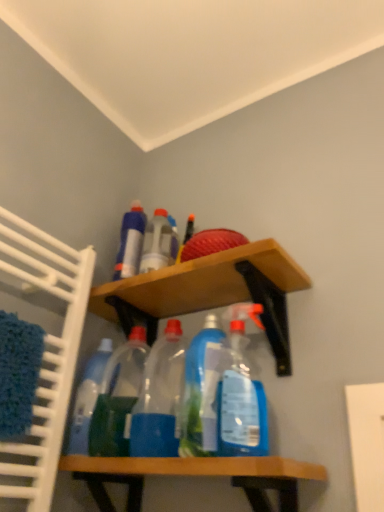
Locate an element on the screen. Image resolution: width=384 pixels, height=512 pixels. wooden shelf at lower center, the second shelf when ordered from top to bottom is located at coordinates (196, 475).

This screenshot has height=512, width=384. Identify the location of wooden shelf at upper center, which ranks as the second shelf in bottom-to-top order. (209, 292).

What do you see at coordinates (158, 243) in the screenshot?
I see `translucent plastic bottle at upper center, marked as the fourth bottle in a right-to-left arrangement` at bounding box center [158, 243].

This screenshot has width=384, height=512. What do you see at coordinates (130, 242) in the screenshot?
I see `blue plastic bottle at upper center, marked as the 6th bottle in a right-to-left arrangement` at bounding box center [130, 242].

The height and width of the screenshot is (512, 384). What do you see at coordinates (118, 397) in the screenshot?
I see `transparent plastic bottle at center, the 2th bottle when ordered from left to right` at bounding box center [118, 397].

Measure the distance between transparent plastic bottle at center, which is the fifth bottle from right to left, and camera.

transparent plastic bottle at center, which is the fifth bottle from right to left, and camera are 34.02 inches apart from each other.

At what (x,y) coordinates should I click in order to perform the action: click on transparent plastic bottles at center, the fourth bottle positioned from the left. Please return your answer as a coordinate pair (x, y). The width and height of the screenshot is (384, 512). Looking at the image, I should click on (160, 397).

Which object is wider, blue translucent bottle at center, placed as the second bottle when sorted from right to left, or transparent plastic bottles at center, the fourth bottle positioned from the left?

transparent plastic bottles at center, the fourth bottle positioned from the left.

Is blue translucent bottle at center, placed as the second bottle when sorted from right to left, facing towards transparent plastic bottles at center, the fourth bottle positioned from the left?

No, blue translucent bottle at center, placed as the second bottle when sorted from right to left, is not turned towards transparent plastic bottles at center, the fourth bottle positioned from the left.

From the image's perspective, is blue translucent bottle at center, placed as the second bottle when sorted from right to left, located above transparent plastic bottles at center, the fourth bottle positioned from the left?

Yes.

I want to click on the 1st bottle counting from the left of the blue translucent bottle at center, placed as the second bottle when sorted from right to left, so click(160, 397).

Is transparent plastic bottle at center, the 2th bottle when ordered from left to right, facing away from blue plastic bottle at upper center, the first bottle viewed from the left?

No, transparent plastic bottle at center, the 2th bottle when ordered from left to right,'s orientation is not away from blue plastic bottle at upper center, the first bottle viewed from the left.

From the image's perspective, is transparent plastic bottle at center, which is the fifth bottle from right to left, located above or below blue plastic bottle at upper center, the first bottle viewed from the left?

Clearly, from the image's perspective, transparent plastic bottle at center, which is the fifth bottle from right to left, is below blue plastic bottle at upper center, the first bottle viewed from the left.

The height and width of the screenshot is (512, 384). Identify the location of the 5th bottle directly beneath the blue plastic bottle at upper center, marked as the 6th bottle in a right-to-left arrangement (from a real-world perspective). (118, 397).

Is transparent plastic bottle at center, the 2th bottle when ordered from left to right, at the left side of blue plastic bottle at upper center, marked as the 6th bottle in a right-to-left arrangement?

Incorrect, transparent plastic bottle at center, the 2th bottle when ordered from left to right, is not on the left side of blue plastic bottle at upper center, marked as the 6th bottle in a right-to-left arrangement.

Is translucent plastic bottle at upper center, marked as the fourth bottle in a right-to-left arrangement, facing towards wooden shelf at upper center, which ranks as the second shelf in bottom-to-top order?

No.

Which of these two, translucent plastic bottle at upper center, which is counted as the 3th bottle, starting from the left, or wooden shelf at upper center, which ranks as the second shelf in bottom-to-top order, stands taller?

translucent plastic bottle at upper center, which is counted as the 3th bottle, starting from the left.

From the picture: From the image's perspective, is translucent plastic bottle at upper center, which is counted as the 3th bottle, starting from the left, on top of wooden shelf at upper center, which is counted as the first shelf, starting from the top?

Indeed, from the image's perspective, translucent plastic bottle at upper center, which is counted as the 3th bottle, starting from the left, is shown above wooden shelf at upper center, which is counted as the first shelf, starting from the top.

Is translucent plastic bottle at upper center, marked as the fourth bottle in a right-to-left arrangement, located outside wooden shelf at upper center, which is counted as the first shelf, starting from the top?

Absolutely, translucent plastic bottle at upper center, marked as the fourth bottle in a right-to-left arrangement, is external to wooden shelf at upper center, which is counted as the first shelf, starting from the top.

From the image's perspective, is blue plastic bottle at upper center, marked as the 6th bottle in a right-to-left arrangement, above or below blue translucent spray bottle at center, marked as the 1th bottle in a right-to-left arrangement?

Clearly, from the image's perspective, blue plastic bottle at upper center, marked as the 6th bottle in a right-to-left arrangement, is above blue translucent spray bottle at center, marked as the 1th bottle in a right-to-left arrangement.

Is blue plastic bottle at upper center, marked as the 6th bottle in a right-to-left arrangement, surrounding blue translucent spray bottle at center, marked as the 1th bottle in a right-to-left arrangement?

No, blue plastic bottle at upper center, marked as the 6th bottle in a right-to-left arrangement, does not contain blue translucent spray bottle at center, marked as the 1th bottle in a right-to-left arrangement.

Which object is wider, blue plastic bottle at upper center, marked as the 6th bottle in a right-to-left arrangement, or blue translucent spray bottle at center, placed as the 6th bottle when sorted from left to right?

With larger width is blue plastic bottle at upper center, marked as the 6th bottle in a right-to-left arrangement.

Measure the distance between translucent plastic bottle at upper center, which is counted as the 3th bottle, starting from the left, and blue plastic bottle at upper center, the first bottle viewed from the left.

translucent plastic bottle at upper center, which is counted as the 3th bottle, starting from the left, and blue plastic bottle at upper center, the first bottle viewed from the left, are 2.43 inches apart from each other.

Which is in front, point (149, 239) or point (126, 220)?

Positioned in front is point (149, 239).

Is translucent plastic bottle at upper center, which is counted as the 3th bottle, starting from the left, bigger or smaller than blue plastic bottle at upper center, the first bottle viewed from the left?

In the image, translucent plastic bottle at upper center, which is counted as the 3th bottle, starting from the left, appears to be smaller than blue plastic bottle at upper center, the first bottle viewed from the left.

Which object is further away from the camera taking this photo, translucent plastic bottle at upper center, which is counted as the 3th bottle, starting from the left, or blue plastic bottle at upper center, the first bottle viewed from the left?

Positioned behind is blue plastic bottle at upper center, the first bottle viewed from the left.

Can you confirm if transparent plastic bottle at center, the 2th bottle when ordered from left to right, is bigger than transparent plastic bottles at center, the fourth bottle positioned from the left?

No.

Considering the relative positions of transparent plastic bottle at center, the 2th bottle when ordered from left to right, and transparent plastic bottles at center, the 3th bottle in the right-to-left sequence, in the image provided, is transparent plastic bottle at center, the 2th bottle when ordered from left to right, in front of transparent plastic bottles at center, the 3th bottle in the right-to-left sequence,?

No.

Is transparent plastic bottle at center, the 2th bottle when ordered from left to right, facing away from transparent plastic bottles at center, the fourth bottle positioned from the left?

No, transparent plastic bottle at center, the 2th bottle when ordered from left to right, is not facing the opposite direction of transparent plastic bottles at center, the fourth bottle positioned from the left.

Is translucent plastic bottle at upper center, marked as the fourth bottle in a right-to-left arrangement, in front of or behind transparent plastic bottles at center, the 3th bottle in the right-to-left sequence, in the image?

Clearly, translucent plastic bottle at upper center, marked as the fourth bottle in a right-to-left arrangement, is behind transparent plastic bottles at center, the 3th bottle in the right-to-left sequence.

Who is bigger, translucent plastic bottle at upper center, which is counted as the 3th bottle, starting from the left, or transparent plastic bottles at center, the fourth bottle positioned from the left?

Bigger between the two is transparent plastic bottles at center, the fourth bottle positioned from the left.

From the picture: Is translucent plastic bottle at upper center, marked as the fourth bottle in a right-to-left arrangement, in contact with transparent plastic bottles at center, the fourth bottle positioned from the left?

No.

Can you confirm if translucent plastic bottle at upper center, which is counted as the 3th bottle, starting from the left, is positioned to the right of transparent plastic bottles at center, the 3th bottle in the right-to-left sequence?

No, translucent plastic bottle at upper center, which is counted as the 3th bottle, starting from the left, is not to the right of transparent plastic bottles at center, the 3th bottle in the right-to-left sequence.

This screenshot has height=512, width=384. I want to click on bottle that is the 1st object to the left of the blue translucent bottle at center, the 5th bottle when ordered from left to right, starting at the anchor, so click(x=160, y=397).

This screenshot has width=384, height=512. Find the location of `the 5th bottle below the blue plastic bottle at upper center, the first bottle viewed from the left (from a real-world perspective)`. the 5th bottle below the blue plastic bottle at upper center, the first bottle viewed from the left (from a real-world perspective) is located at coordinates (118, 397).

When comparing their distances from blue plastic bottle at upper center, the first bottle viewed from the left, does transparent plastic bottle at center, the 2th bottle when ordered from left to right, or transparent plastic bottles at center, the fourth bottle positioned from the left, seem closer?

Among the two, transparent plastic bottle at center, the 2th bottle when ordered from left to right, is located nearer to blue plastic bottle at upper center, the first bottle viewed from the left.

Considering their positions, is transparent plastic bottles at center, the fourth bottle positioned from the left, positioned further to wooden shelf at upper center, which is counted as the first shelf, starting from the top, than translucent plastic bottle at upper center, marked as the fourth bottle in a right-to-left arrangement?

Among the two, transparent plastic bottles at center, the fourth bottle positioned from the left, is located further to wooden shelf at upper center, which is counted as the first shelf, starting from the top.

Estimate the real-world distances between objects in this image. Which object is further from blue translucent bottle at center, the 5th bottle when ordered from left to right, translucent plastic bottle at upper center, marked as the fourth bottle in a right-to-left arrangement, or transparent plastic bottles at center, the 3th bottle in the right-to-left sequence?

Among the two, translucent plastic bottle at upper center, marked as the fourth bottle in a right-to-left arrangement, is located further to blue translucent bottle at center, the 5th bottle when ordered from left to right.

Considering their positions, is translucent plastic bottle at upper center, marked as the fourth bottle in a right-to-left arrangement, positioned further to blue plastic bottle at upper center, marked as the 6th bottle in a right-to-left arrangement, than wooden shelf at upper center, which ranks as the second shelf in bottom-to-top order?

wooden shelf at upper center, which ranks as the second shelf in bottom-to-top order.

Estimate the real-world distances between objects in this image. Which object is further from blue plastic bottle at upper center, marked as the 6th bottle in a right-to-left arrangement, blue translucent bottle at center, placed as the second bottle when sorted from right to left, or translucent plastic bottle at upper center, which is counted as the 3th bottle, starting from the left?

blue translucent bottle at center, placed as the second bottle when sorted from right to left, lies further to blue plastic bottle at upper center, marked as the 6th bottle in a right-to-left arrangement, than the other object.

Based on their spatial positions, is wooden shelf at upper center, which is counted as the first shelf, starting from the top, or blue translucent bottle at center, placed as the second bottle when sorted from right to left, further from translucent plastic bottle at upper center, which is counted as the 3th bottle, starting from the left?

blue translucent bottle at center, placed as the second bottle when sorted from right to left.

Looking at the image, which one is located closer to transparent plastic bottles at center, the fourth bottle positioned from the left, translucent plastic bottle at upper center, marked as the fourth bottle in a right-to-left arrangement, or transparent plastic bottle at center, which is the fifth bottle from right to left?

Based on the image, transparent plastic bottle at center, which is the fifth bottle from right to left, appears to be nearer to transparent plastic bottles at center, the fourth bottle positioned from the left.

Based on their spatial positions, is translucent plastic bottle at upper center, which is counted as the 3th bottle, starting from the left, or wooden shelf at lower center, the first shelf from the bottom, further from blue translucent spray bottle at center, placed as the 6th bottle when sorted from left to right?

translucent plastic bottle at upper center, which is counted as the 3th bottle, starting from the left, is positioned further to the anchor blue translucent spray bottle at center, placed as the 6th bottle when sorted from left to right.

At what (x,y) coordinates should I click in order to perform the action: click on shelf located between wooden shelf at lower center, the first shelf from the bottom, and blue plastic bottle at upper center, the first bottle viewed from the left, in the depth direction. Please return your answer as a coordinate pair (x, y). The width and height of the screenshot is (384, 512). Looking at the image, I should click on (209, 292).

In order to click on shelf located between blue translucent spray bottle at center, placed as the 6th bottle when sorted from left to right, and translucent plastic bottle at upper center, which is counted as the 3th bottle, starting from the left, in the depth direction in this screenshot , I will do `click(209, 292)`.

You are a GUI agent. You are given a task and a screenshot of the screen. Output one action in this format:
    pyautogui.click(x=<x>, y=<y>)
    Task: Click on the shelf positioned between blue translucent spray bottle at center, placed as the 6th bottle when sorted from left to right, and blue plastic bottle at upper center, the first bottle viewed from the left, from near to far
    
    Given the screenshot: What is the action you would take?
    pyautogui.click(x=209, y=292)

Locate an element on the screen. The image size is (384, 512). shelf between translucent plastic bottle at upper center, marked as the fourth bottle in a right-to-left arrangement, and wooden shelf at lower center, the second shelf when ordered from top to bottom, in the vertical direction is located at coordinates (209, 292).